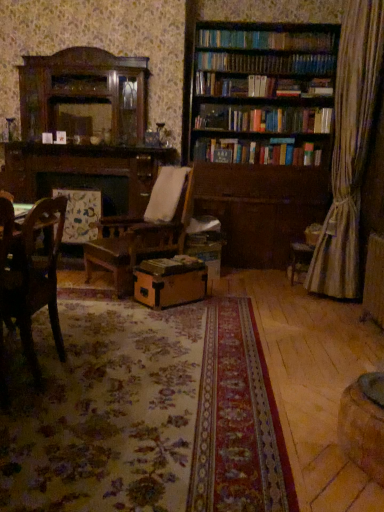
At what (x,y) coordinates should I click in order to perform the action: click on vacant space to the right of wooden chair at left. Please return your answer as a coordinate pair (x, y). This screenshot has width=384, height=512. Looking at the image, I should click on (109, 374).